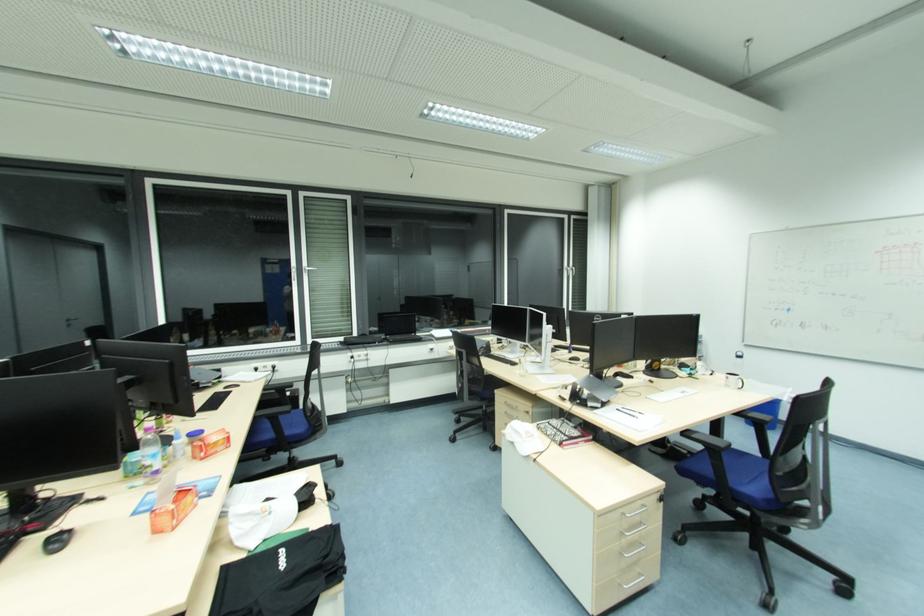
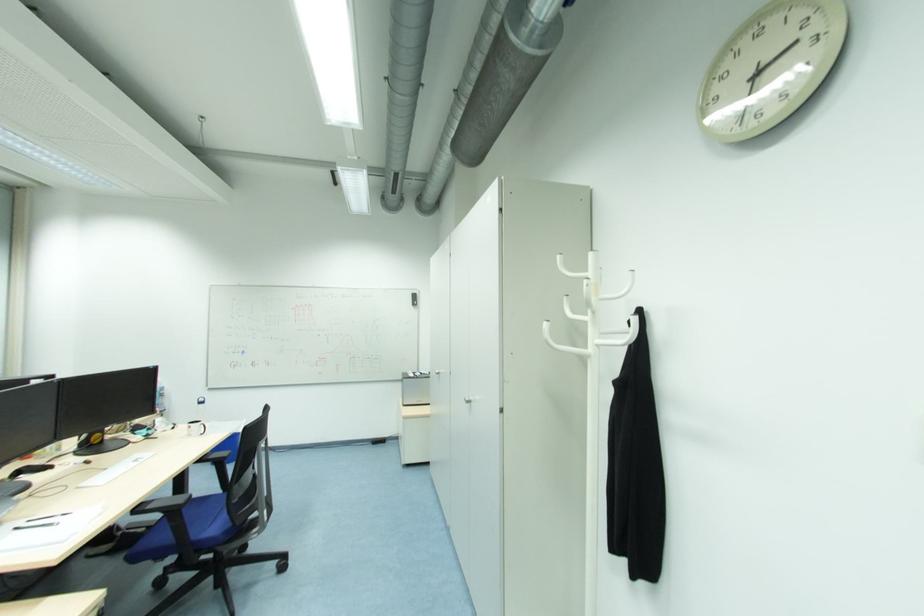
Where in the second image is the point corresponding to the point at 789,400 from the first image?

(244, 432)